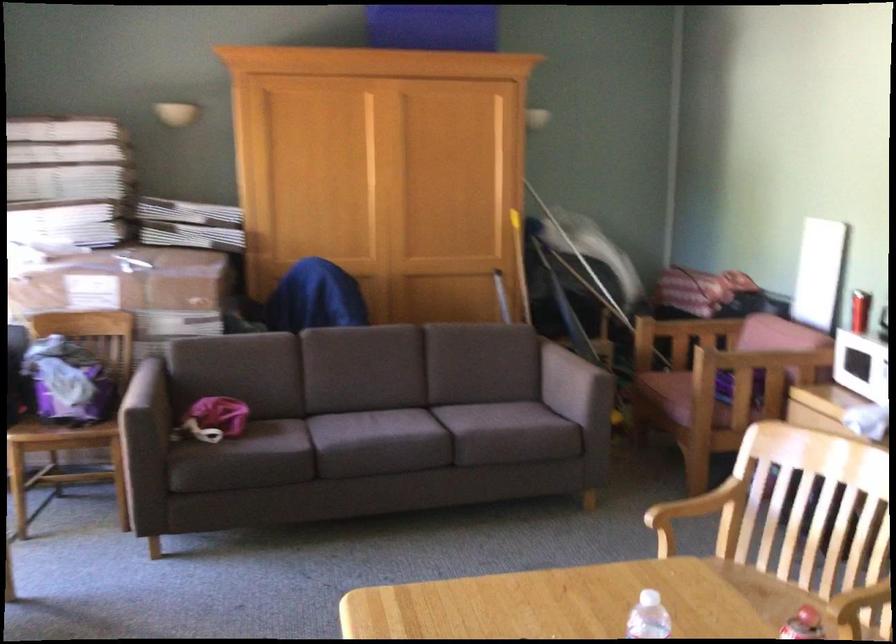
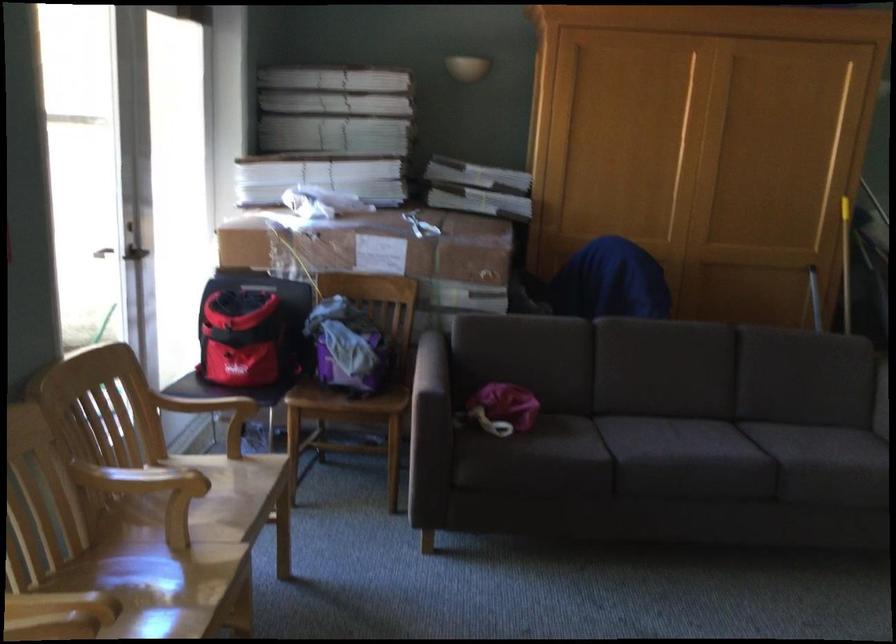
In the second image, find the point that corresponds to pixel 142 389 in the first image.

(431, 365)